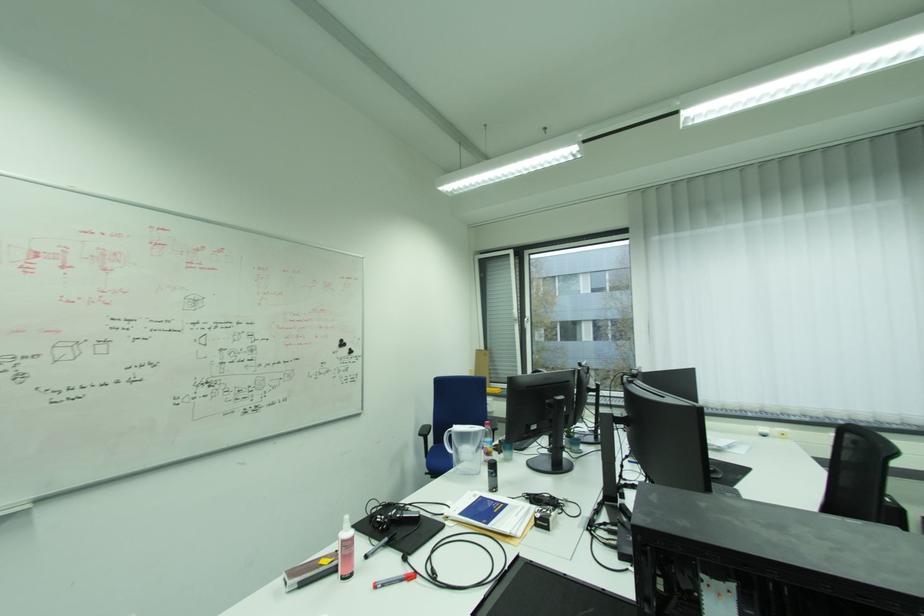
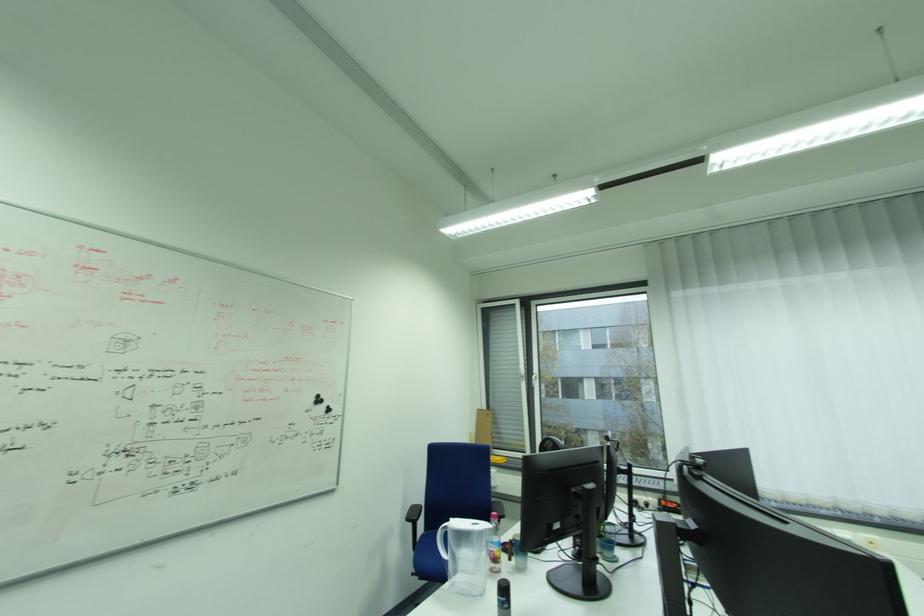
In the second image, find the point that corresponds to (x=428, y=435) in the first image.

(415, 521)